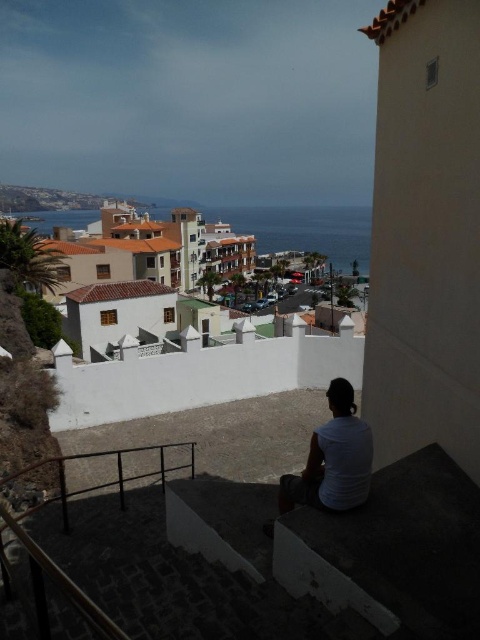
Is point (232, 220) behind point (162, 460)?

Yes, it is.

Can you confirm if blue water at center is bigger than black metal rail at lower left?

Correct, blue water at center is larger in size than black metal rail at lower left.

Which is in front, point (367, 220) or point (12, 516)?

Point (12, 516)

Locate an element on the screen. Image resolution: width=480 pixels, height=640 pixels. blue water at center is located at coordinates (305, 230).

Which is below, white matte shirt at lower center or black metal rail at lower left?

black metal rail at lower left is lower down.

Which is behind, point (363, 464) or point (27, 513)?

The point (27, 513) is more distant.

The height and width of the screenshot is (640, 480). In order to click on white matte shirt at lower center in this screenshot , I will do `click(333, 460)`.

Does blue water at center have a lesser height compared to white matte shirt at lower center?

No, blue water at center is not shorter than white matte shirt at lower center.

Who is positioned more to the right, blue water at center or white matte shirt at lower center?

From the viewer's perspective, white matte shirt at lower center appears more on the right side.

Identify the location of blue water at center. point(305,230).

This screenshot has height=640, width=480. Find the location of `blue water at center`. blue water at center is located at coordinates (305, 230).